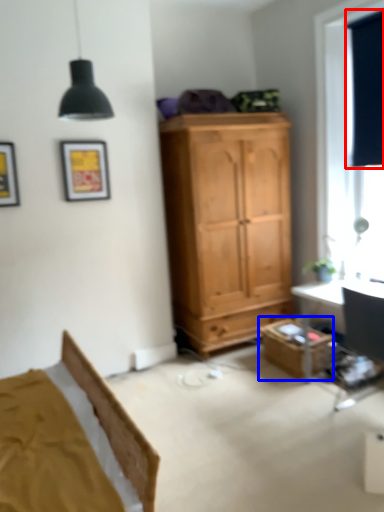
Question: Which point is closer to the camera, curtain (highlighted by a red box) or cabinetry (highlighted by a blue box)?

Choices:
 (A) curtain
 (B) cabinetry

Answer: (A)